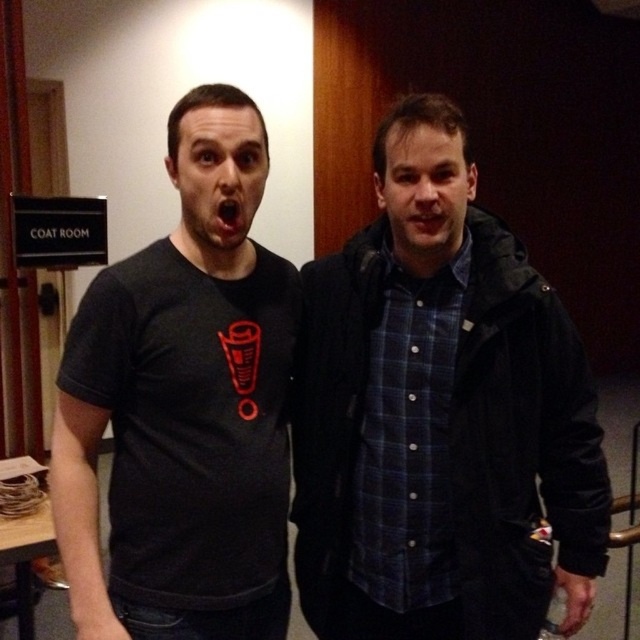
Question: Estimate the real-world distances between objects in this image. Which object is farther from the black matte jacket at center?

Choices:
 (A) black matte t-shirt at left
 (B) black matte mouth at center

Answer: (B)

Question: Which object appears farthest from the camera in this image?

Choices:
 (A) black matte jacket at center
 (B) black matte mouth at center

Answer: (A)

Question: Is black matte jacket at center to the right of black matte mouth at center from the viewer's perspective?

Choices:
 (A) yes
 (B) no

Answer: (A)

Question: Is black matte t-shirt at left to the right of black matte mouth at center from the viewer's perspective?

Choices:
 (A) yes
 (B) no

Answer: (B)

Question: Which point appears farthest from the camera in this image?

Choices:
 (A) (220, 221)
 (B) (145, 339)

Answer: (B)

Question: Does black matte jacket at center appear on the left side of black matte t-shirt at left?

Choices:
 (A) no
 (B) yes

Answer: (A)